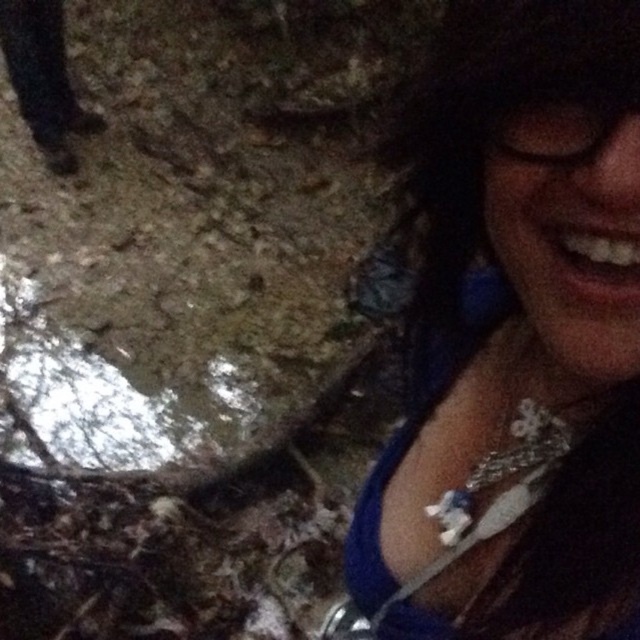
You are a photographer planning to take a closeup shot of both the blue fabric necklace at upper right and the transparent plastic goggles at upper right. Since you want to capture their full details, which object should you focus on first to ensure it fits within your camera frame?

The blue fabric necklace at upper right is wider than the transparent plastic goggles at upper right, so you should focus on capturing the blue fabric necklace at upper right first to ensure it fits within the camera frame before adjusting for the smaller goggles.

You are a photographer trying to capture the blue fabric necklace at upper right and the transparent plastic goggles at upper right in a single frame. Based on their positions, will the necklace appear below or above the goggles in the photo?

The blue fabric necklace at upper right is positioned under the transparent plastic goggles at upper right, so in the photo, the necklace will appear below the goggles.